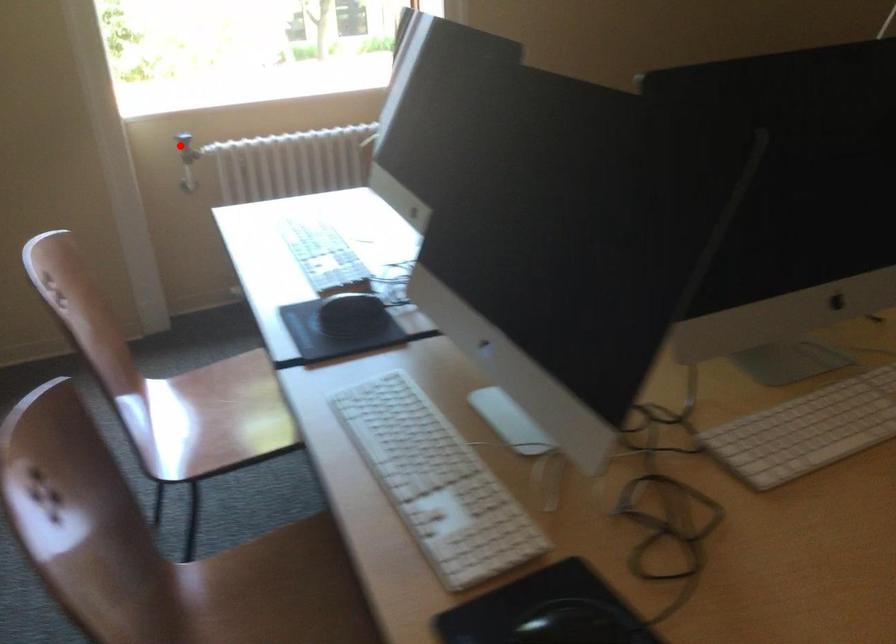
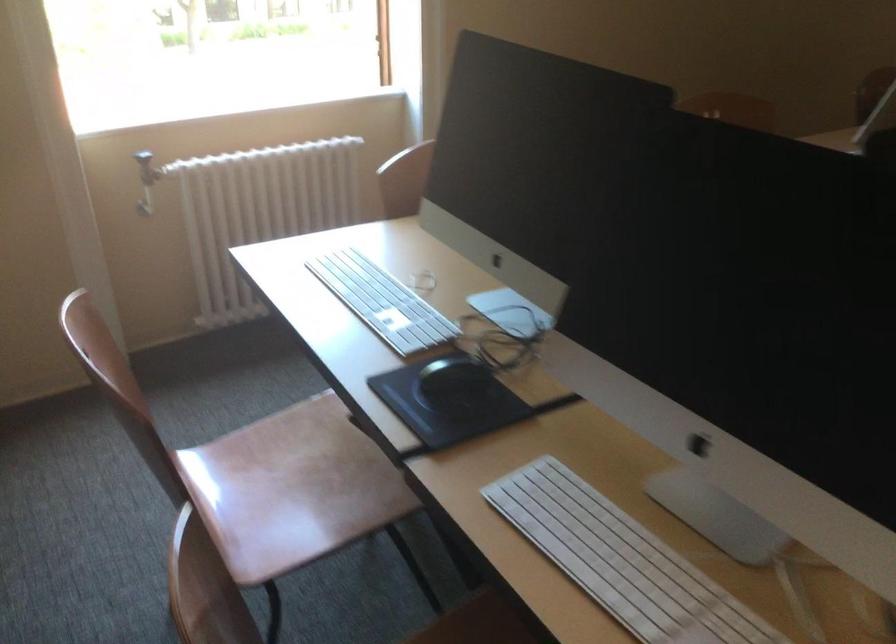
Where in the second image is the point corresponding to the highlighted location from the first image?

(147, 167)